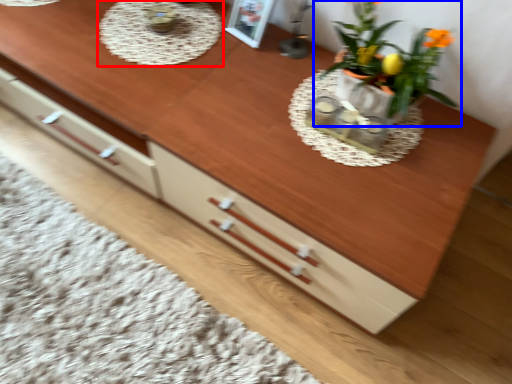
Question: Which of the following is the closest to the observer, round table (highlighted by a red box) or houseplant (highlighted by a blue box)?

Choices:
 (A) round table
 (B) houseplant

Answer: (B)